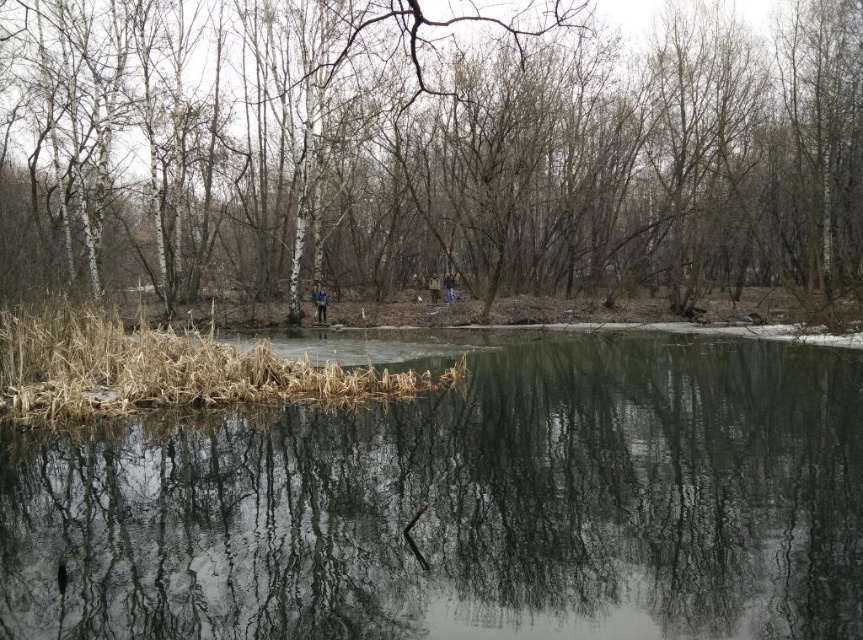
Question: Among these objects, which one is farthest from the camera?

Choices:
 (A) brown leather jacket at center
 (B) brown bark tree at center

Answer: (A)

Question: Among these points, which one is farthest from the camera?

Choices:
 (A) (21, 332)
 (B) (438, 278)
 (C) (448, 280)
 (D) (323, 323)

Answer: (B)

Question: Observing the image, what is the correct spatial positioning of brown bark tree at center in reference to brown dry reed at center?

Choices:
 (A) above
 (B) below

Answer: (A)

Question: Observing the image, what is the correct spatial positioning of brown dry reed at center in reference to brown leather jacket at center?

Choices:
 (A) left
 (B) right

Answer: (A)

Question: Is blue jeans at center positioned in front of dark blue jacket at center?

Choices:
 (A) no
 (B) yes

Answer: (B)

Question: Which point appears closest to the camera in this image?

Choices:
 (A) (61, 413)
 (B) (673, 449)

Answer: (B)